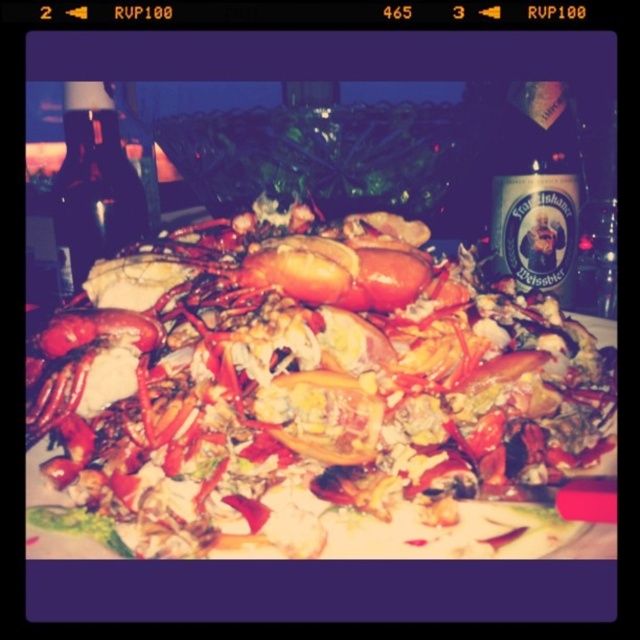
Question: Which point is closer to the camera taking this photo?

Choices:
 (A) (392, 428)
 (B) (500, 262)
 (C) (86, 141)

Answer: (A)

Question: Which is farther from the translucent glass bottle at upper right?

Choices:
 (A) shiny red lobster at center
 (B) dark glass bottle at upper left

Answer: (B)

Question: Is shiny red lobster at center further to camera compared to translucent glass bottle at upper right?

Choices:
 (A) no
 (B) yes

Answer: (A)

Question: Which object is the farthest from the dark glass bottle at upper left?

Choices:
 (A) translucent glass bottle at upper right
 (B) shiny red lobster at center

Answer: (A)

Question: Observing the image, what is the correct spatial positioning of shiny red lobster at center in reference to translucent glass bottle at upper right?

Choices:
 (A) below
 (B) above

Answer: (A)

Question: Is shiny red lobster at center further to camera compared to translucent glass bottle at upper right?

Choices:
 (A) yes
 (B) no

Answer: (B)